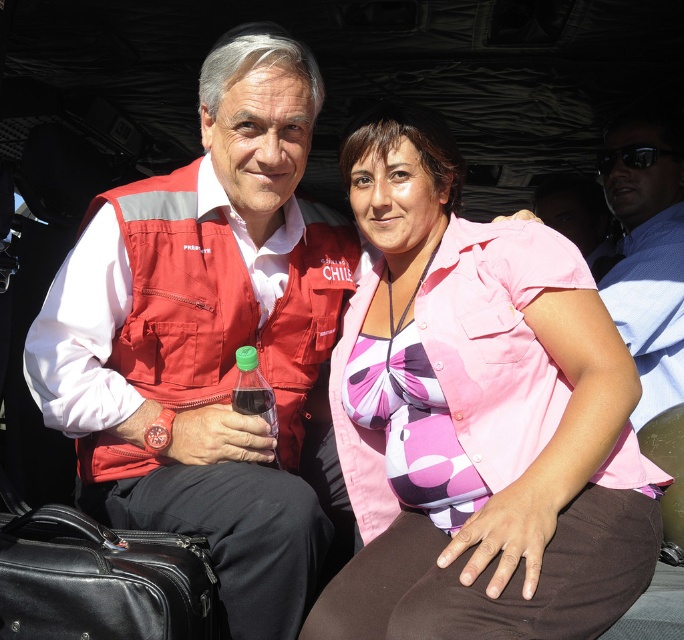
Question: In this image, where is pink fabric shirt at center located relative to matte red vest at center?

Choices:
 (A) left
 (B) right

Answer: (B)

Question: Which object appears closest to the camera in this image?

Choices:
 (A) matte red vest at left
 (B) matte red vest at center
 (C) pink fabric shirt at center
 (D) black leather suitcase at lower left

Answer: (C)

Question: Estimate the real-world distances between objects in this image. Which object is farther from the pink fabric shirt at center?

Choices:
 (A) matte red vest at left
 (B) blue shirt at upper right
 (C) green plastic bottle at center
 (D) black leather suitcase at lower left

Answer: (B)

Question: Estimate the real-world distances between objects in this image. Which object is closer to the blue shirt at upper right?

Choices:
 (A) green plastic bottle at center
 (B) matte red vest at left
 (C) pink fabric shirt at center

Answer: (C)

Question: Is matte red vest at left wider than green plastic bottle at center?

Choices:
 (A) yes
 (B) no

Answer: (A)

Question: From the image, what is the correct spatial relationship of matte red vest at center in relation to blue shirt at upper right?

Choices:
 (A) below
 (B) above

Answer: (A)